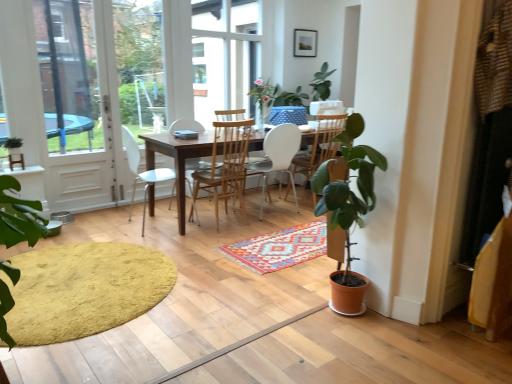
Image resolution: width=512 pixels, height=384 pixels. I want to click on vacant space in yellow soft rug at lower left, the second doormat from the right (from a real-world perspective), so click(91, 271).